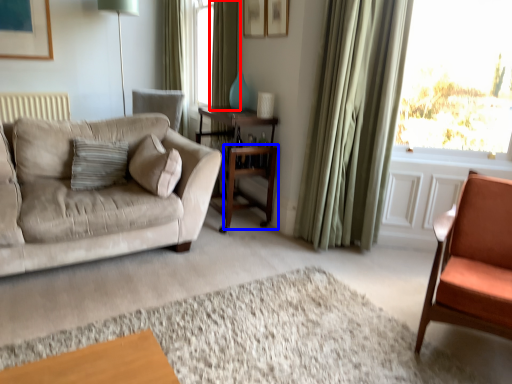
Question: Which of the following is the closest to the observer, curtain (highlighted by a red box) or table (highlighted by a blue box)?

Choices:
 (A) curtain
 (B) table

Answer: (B)